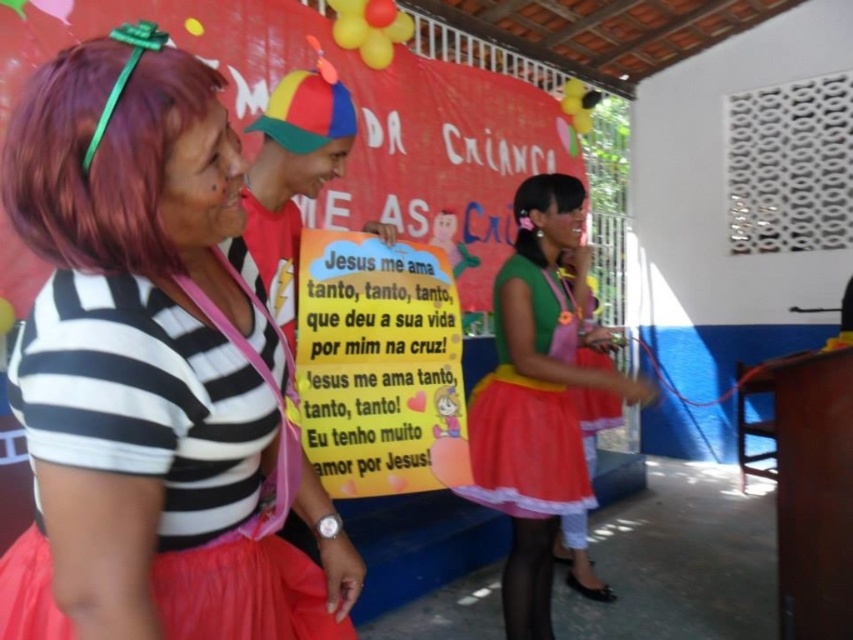
I want to click on purple silky hair at left, so click(x=102, y=150).

Which of these two, purple silky hair at left or matte green dress at center, stands taller?

With more height is matte green dress at center.

Is point (50, 68) closer to camera compared to point (616, 371)?

Yes, point (50, 68) is in front of point (616, 371).

Where is `purple silky hair at left`? The height and width of the screenshot is (640, 853). purple silky hair at left is located at coordinates (102, 150).

Who is taller, purple silky hair at left or matte green fabric dress at center?

matte green fabric dress at center

Can you confirm if purple silky hair at left is positioned to the left of matte green fabric dress at center?

Yes, purple silky hair at left is to the left of matte green fabric dress at center.

Locate an element on the screen. purple silky hair at left is located at coordinates (102, 150).

I want to click on purple silky hair at left, so click(102, 150).

Is purple silky hair at left thinner than black silky hair at upper center?

Yes, purple silky hair at left is thinner than black silky hair at upper center.

Does purple silky hair at left appear on the left side of black silky hair at upper center?

Yes, purple silky hair at left is to the left of black silky hair at upper center.

Locate an element on the screen. The width and height of the screenshot is (853, 640). purple silky hair at left is located at coordinates (102, 150).

Where is `purple silky hair at left`? purple silky hair at left is located at coordinates (102, 150).